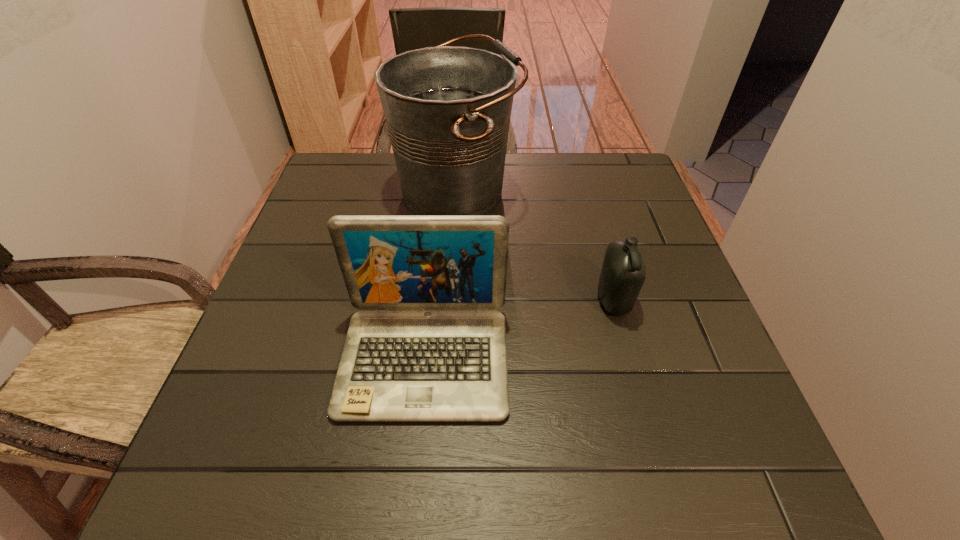
Find the location of a particular element. the farthest object is located at coordinates (x=447, y=108).

The image size is (960, 540). What are the coordinates of `bucket` in the screenshot? It's located at (447, 108).

This screenshot has height=540, width=960. I want to click on the second shortest object, so click(x=427, y=346).

Find the location of a particular element. bottle is located at coordinates (623, 272).

Find the location of `the rightmost object`. the rightmost object is located at coordinates (623, 272).

Identify the location of free space located 0.110m on the front of the bucket. This screenshot has width=960, height=540. (451, 267).

You are a GUI agent. You are given a task and a screenshot of the screen. Output one action in this format:
    pyautogui.click(x=<x>, y=<y>)
    Task: Click on the free region located on the screen of the second shortest object
    
    Given the screenshot: What is the action you would take?
    pyautogui.click(x=413, y=472)

Where is `vacant region located 0.150m on the back of the rightmost object`? This screenshot has height=540, width=960. vacant region located 0.150m on the back of the rightmost object is located at coordinates (595, 237).

Locate an element on the screen. This screenshot has width=960, height=540. object at the far edge is located at coordinates (447, 108).

Image resolution: width=960 pixels, height=540 pixels. Find the location of `object that is at the right edge`. object that is at the right edge is located at coordinates (623, 272).